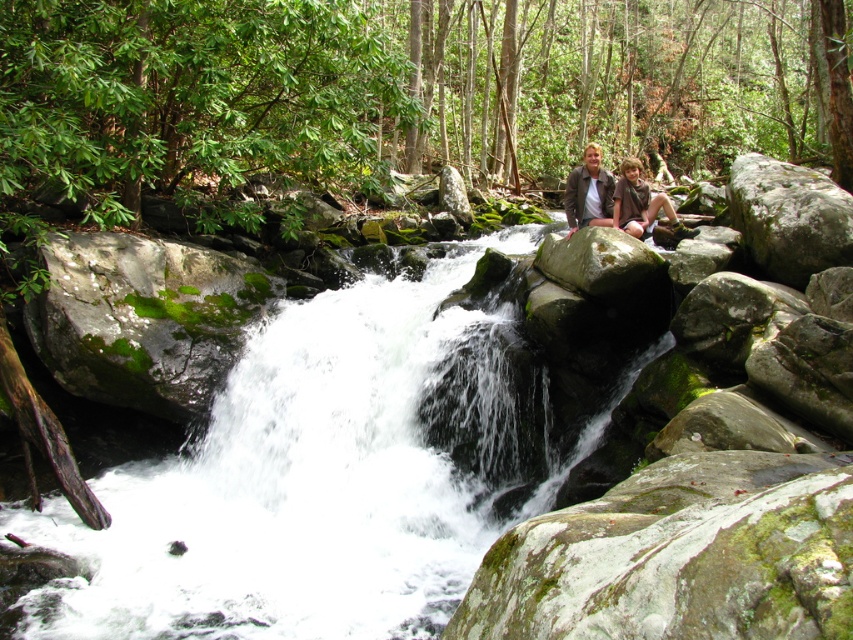
Where is `green mossy rock at center-right`? green mossy rock at center-right is located at coordinates (679, 556).

Is the position of green mossy rock at center-right more distant than that of brown suede jacket at upper center?

No, green mossy rock at center-right is in front of brown suede jacket at upper center.

You are a GUI agent. You are given a task and a screenshot of the screen. Output one action in this format:
    pyautogui.click(x=<x>, y=<y>)
    Task: Click on the green mossy rock at center-right
    
    Given the screenshot: What is the action you would take?
    pyautogui.click(x=679, y=556)

Does green mossy rock at center-right have a larger size compared to brown leather jacket at center?

No, green mossy rock at center-right is not bigger than brown leather jacket at center.

Does point (833, 460) lie behind point (576, 208)?

No, it is in front of (576, 208).

Describe the element at coordinates (679, 556) in the screenshot. I see `green mossy rock at center-right` at that location.

Locate an element on the screen. This screenshot has height=640, width=853. green mossy rock at center-right is located at coordinates (679, 556).

Which is more to the right, green mossy rock at upper right or brown leather jacket at upper center?

green mossy rock at upper right

Between point (849, 237) and point (570, 221), which one is positioned behind?

Point (570, 221)

Who is more forward, (x=735, y=204) or (x=579, y=186)?

Positioned in front is point (x=735, y=204).

Find the location of `green mossy rock at upper right`. green mossy rock at upper right is located at coordinates pyautogui.click(x=788, y=218).